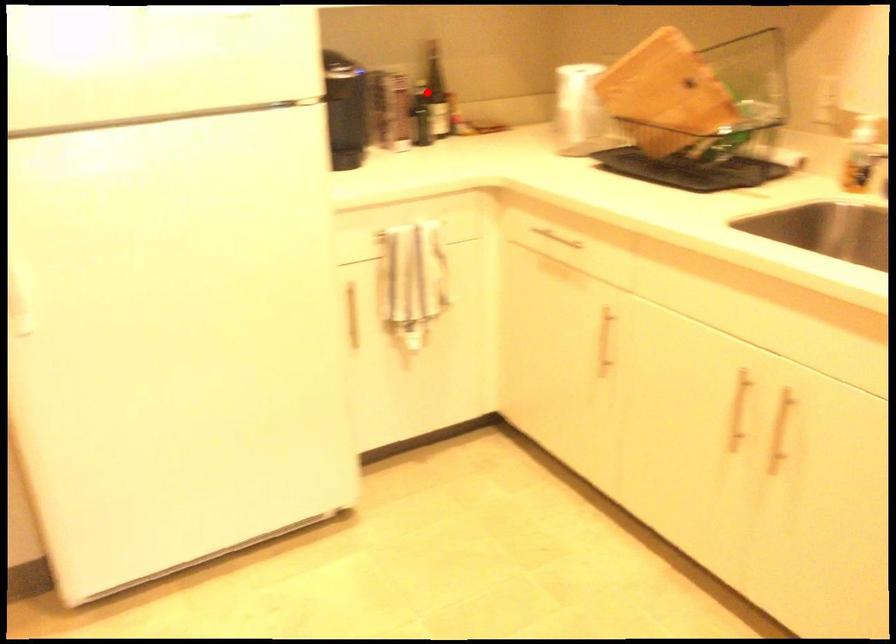
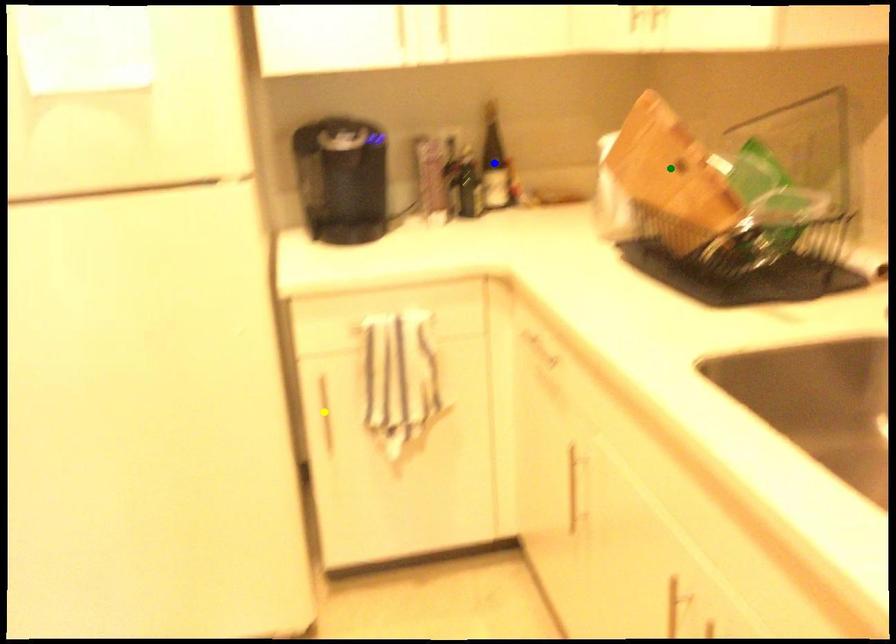
Question: I am providing you with two images of the same scene from different viewpoints. A red point is marked on the first image. You are given multiple points on the second image. Which spot in image 2 lines up with the point in image 1?

Choices:
 (A) green point
 (B) blue point
 (C) yellow point

Answer: (B)